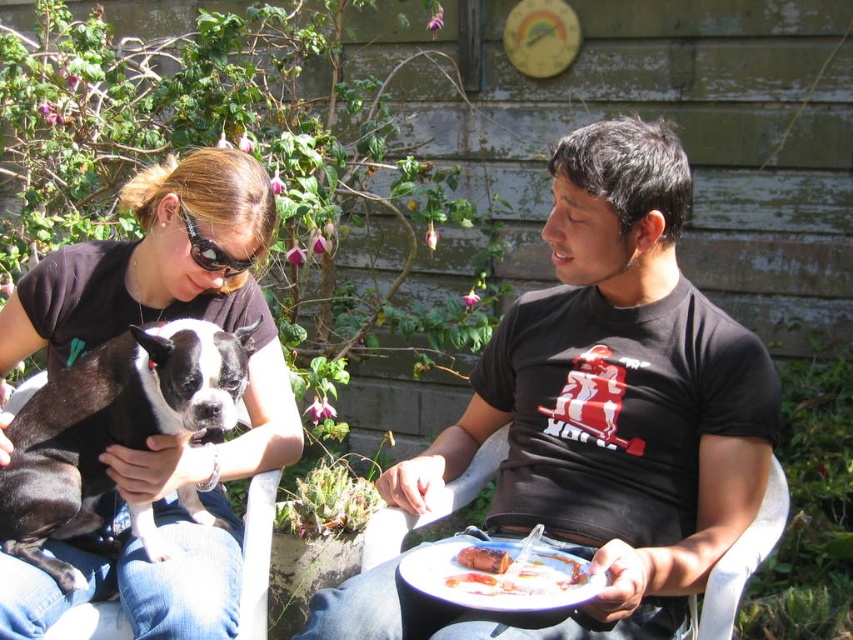
Question: Is matte black t-shirt at upper left positioned before black plastic goggles at upper center?

Choices:
 (A) yes
 (B) no

Answer: (A)

Question: Which point appears farthest from the camera in this image?

Choices:
 (A) (51, 356)
 (B) (508, 596)
 (C) (554, 364)

Answer: (A)

Question: Which point is farther to the camera?

Choices:
 (A) (518, 556)
 (B) (10, 572)
 (C) (506, 563)
 (D) (213, 257)

Answer: (D)

Question: Which of the following is the closest to the observer?

Choices:
 (A) (505, 433)
 (B) (20, 304)

Answer: (B)

Question: Is matte black t-shirt at upper left below black plastic goggles at upper center?

Choices:
 (A) yes
 (B) no

Answer: (A)

Question: Is white plastic plate at lower center positioned in front of white plastic chair at lower center?

Choices:
 (A) no
 (B) yes

Answer: (B)